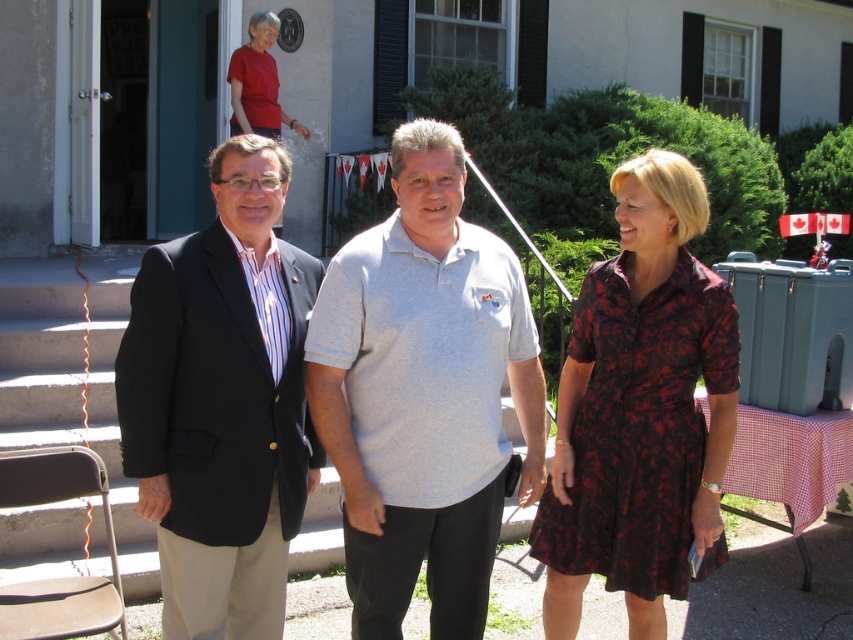
Who is more distant from viewer, (514, 266) or (683, 444)?

Point (514, 266)

Between gray cotton polo shirt at center and dark red floral dress at center, which one has less height?

gray cotton polo shirt at center is shorter.

The height and width of the screenshot is (640, 853). I want to click on gray cotton polo shirt at center, so click(x=422, y=394).

Is point (666, 512) positioned behind point (242, 74)?

No.

Measure the distance between point (613, 188) and camera.

Point (613, 188) is 2.99 meters from camera.

This screenshot has height=640, width=853. I want to click on dark red floral dress at center, so click(x=640, y=410).

Can you confirm if matte black blazer at center is bigger than dark red floral dress at center?

Incorrect, matte black blazer at center is not larger than dark red floral dress at center.

Does point (294, 371) come farther from viewer compared to point (683, 257)?

No.

This screenshot has height=640, width=853. Find the location of `matte black blazer at center`. matte black blazer at center is located at coordinates (222, 403).